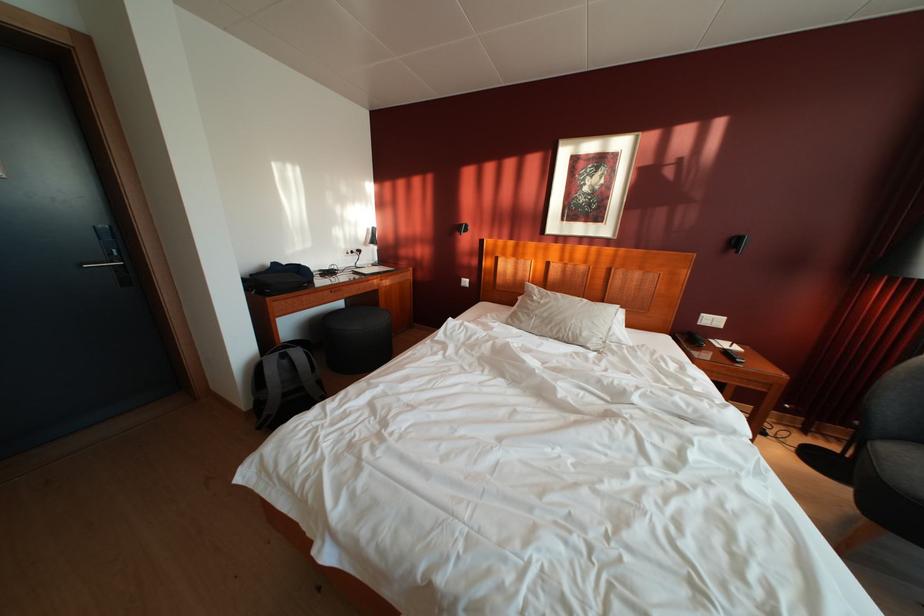
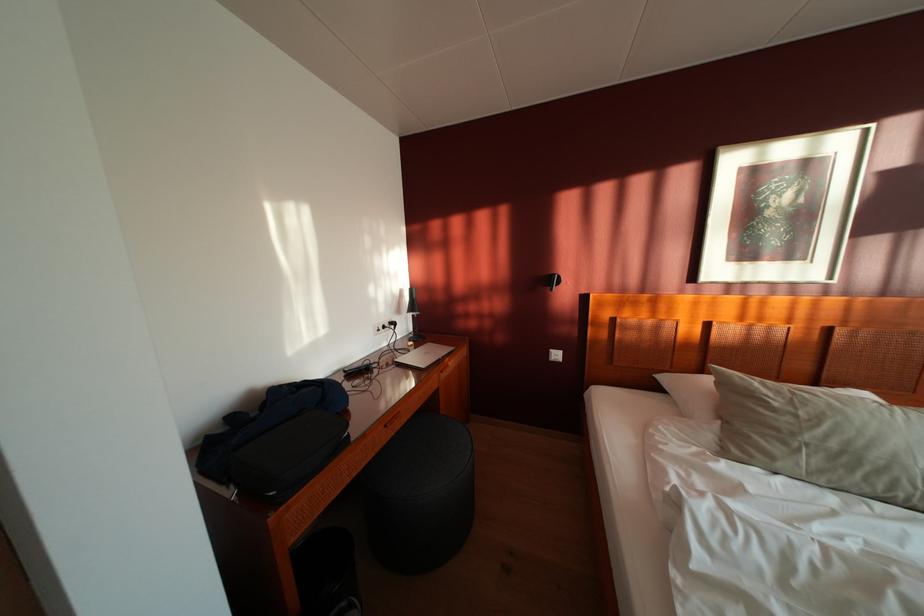
Looking at this image, in a continuous first-person perspective shot, in which direction is the camera moving?

The movement direction of the cameraman is left, forward.